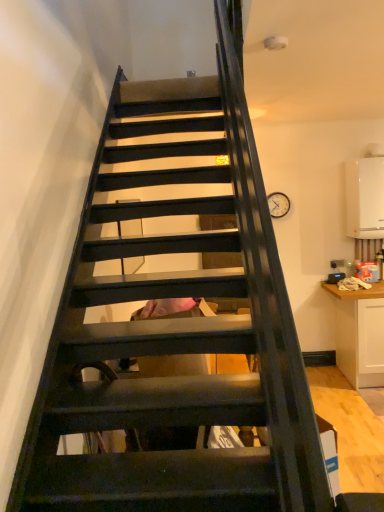
Locate an element on the screen. The width and height of the screenshot is (384, 512). white glossy boiler at upper right is located at coordinates (365, 198).

What do you see at coordinates (365, 198) in the screenshot? The height and width of the screenshot is (512, 384). I see `white glossy boiler at upper right` at bounding box center [365, 198].

Identify the location of cardboard box at center. (330, 453).

Measure the distance between point (333, 494) and camera.

Point (333, 494) is 97.40 centimeters from camera.

This screenshot has width=384, height=512. Describe the element at coordinates (330, 453) in the screenshot. I see `cardboard box at center` at that location.

Where is `white glossy boiler at upper right`? This screenshot has width=384, height=512. white glossy boiler at upper right is located at coordinates (365, 198).

Is cardboard box at center to the left or to the right of white glossy boiler at upper right in the image?

cardboard box at center is positioned on white glossy boiler at upper right's left side.

Is cardboard box at center closer to the viewer compared to white glossy boiler at upper right?

Yes, it is.

Which is closer, (336,474) or (356,212)?

The point (336,474) is in front.

From the image's perspective, is cardboard box at center located above or below white glossy boiler at upper right?

cardboard box at center is situated lower than white glossy boiler at upper right in the image.

From a real-world perspective, which object rests below the other?

From a 3D spatial view, cardboard box at center is below.

In terms of width, does cardboard box at center look wider or thinner when compared to white glossy boiler at upper right?

In the image, cardboard box at center appears to be more narrow than white glossy boiler at upper right.

Considering the sizes of objects cardboard box at center and white glossy boiler at upper right in the image provided, who is shorter, cardboard box at center or white glossy boiler at upper right?

With less height is cardboard box at center.

Who is smaller, cardboard box at center or white glossy boiler at upper right?

cardboard box at center.

Is cardboard box at center spatially inside white glossy boiler at upper right, or outside of it?

cardboard box at center cannot be found inside white glossy boiler at upper right.

Is cardboard box at center beside white glossy boiler at upper right?

They are not placed beside each other.

Is cardboard box at center facing towards white glossy boiler at upper right?

No, cardboard box at center does not turn towards white glossy boiler at upper right.

What's the angular difference between cardboard box at center and white glossy boiler at upper right's facing directions?

They differ by 85.6 degrees in their facing directions.

Where is `cardboard box that is on the left side of white glossy boiler at upper right`? cardboard box that is on the left side of white glossy boiler at upper right is located at coordinates (330, 453).

Which object is positioned more to the left, white glossy boiler at upper right or cardboard box at center?

cardboard box at center is more to the left.

Is white glossy boiler at upper right in front of or behind cardboard box at center in the image?

white glossy boiler at upper right is behind cardboard box at center.

Does point (360, 170) come behind point (329, 444)?

Yes, it is.

From the image's perspective, which one is positioned lower, white glossy boiler at upper right or cardboard box at center?

cardboard box at center is shown below in the image.

From a real-world perspective, who is located lower, white glossy boiler at upper right or cardboard box at center?

cardboard box at center is physically lower.

Between white glossy boiler at upper right and cardboard box at center, which one has smaller width?

cardboard box at center is thinner.

Between white glossy boiler at upper right and cardboard box at center, which one has less height?

cardboard box at center is shorter.

Considering the relative sizes of white glossy boiler at upper right and cardboard box at center in the image provided, is white glossy boiler at upper right bigger than cardboard box at center?

Indeed, white glossy boiler at upper right has a larger size compared to cardboard box at center.

Which is correct: white glossy boiler at upper right is inside cardboard box at center, or outside of it?

white glossy boiler at upper right is not enclosed by cardboard box at center.

Is white glossy boiler at upper right directly adjacent to cardboard box at center?

No, white glossy boiler at upper right is not in contact with cardboard box at center.

Is white glossy boiler at upper right oriented away from cardboard box at center?

No, white glossy boiler at upper right is not facing the opposite direction of cardboard box at center.

How many degrees apart are the facing directions of white glossy boiler at upper right and cardboard box at center?

There is a 85.6-degree angle between the facing directions of white glossy boiler at upper right and cardboard box at center.

Find the location of a particular element. cardboard box below the white glossy boiler at upper right (from the image's perspective) is located at coordinates (330, 453).

Locate an element on the screen. The width and height of the screenshot is (384, 512). appliance above the cardboard box at center (from a real-world perspective) is located at coordinates (365, 198).

Find the location of a particular element. This screenshot has width=384, height=512. cardboard box in front of the white glossy boiler at upper right is located at coordinates (330, 453).